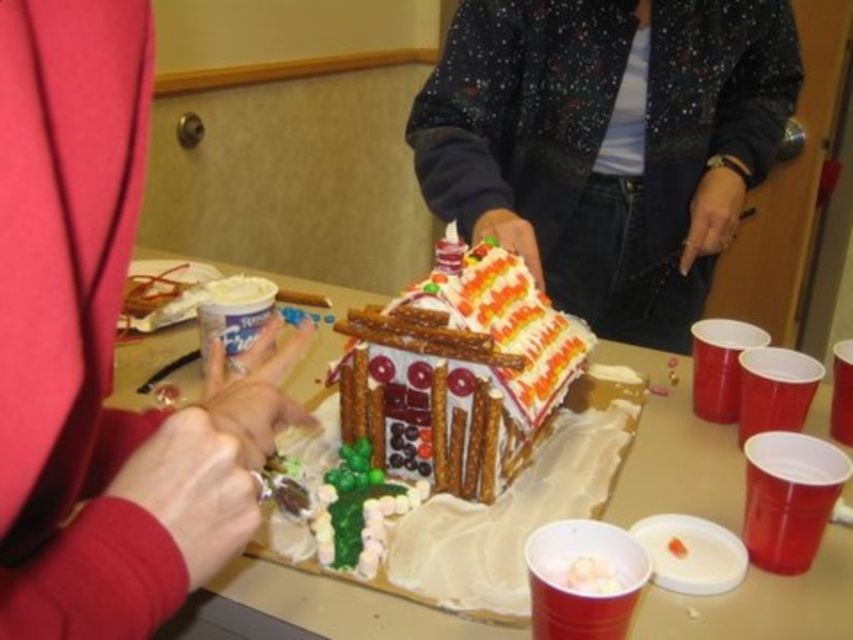
Question: Considering the real-world distances, which object is farthest from the decorative gingerbread house at center?

Choices:
 (A) matte red sweater at upper left
 (B) white fondant gingerbread house at center

Answer: (A)

Question: Which point is farther from the camera taking this photo?

Choices:
 (A) (99, 577)
 (B) (469, 474)
 (C) (527, 152)
 (D) (824, 394)

Answer: (C)

Question: Which point is farther from the camera taking this photo?

Choices:
 (A) (102, 40)
 (B) (651, 324)

Answer: (B)

Question: Does white fondant gingerbread house at center appear on the right side of decorative gingerbread house at center?

Choices:
 (A) no
 (B) yes

Answer: (B)

Question: From the image, what is the correct spatial relationship of speckled fabric jacket at center in relation to decorative gingerbread house at center?

Choices:
 (A) left
 (B) right

Answer: (B)

Question: Does matte red sweater at upper left appear over speckled fabric jacket at center?

Choices:
 (A) no
 (B) yes

Answer: (A)